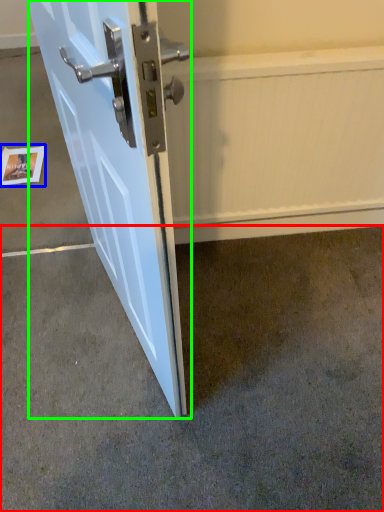
Question: Which object is positioned closest to concrete (highlighted by a red box)? Select from postcard (highlighted by a blue box) and door (highlighted by a green box).

Choices:
 (A) postcard
 (B) door

Answer: (B)